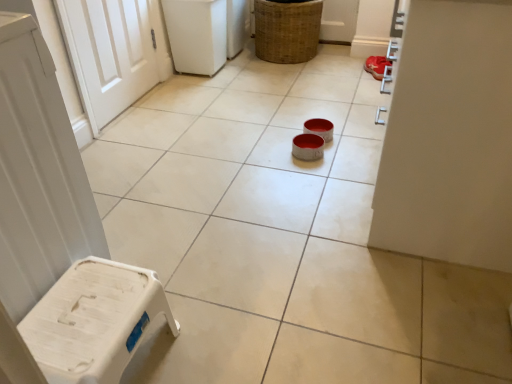
Question: Would you say woven brown basket at upper center is inside or outside white plastic stool at lower left?

Choices:
 (A) inside
 (B) outside

Answer: (B)

Question: From a real-world perspective, is woven brown basket at upper center above or below white plastic stool at lower left?

Choices:
 (A) above
 (B) below

Answer: (A)

Question: Which object is positioned closest to the red suede shoe at upper right?

Choices:
 (A) white plastic stool at lower left
 (B) woven brown basket at upper center

Answer: (B)

Question: Which is nearer to the red suede shoe at upper right?

Choices:
 (A) white plastic stool at lower left
 (B) woven brown basket at upper center

Answer: (B)